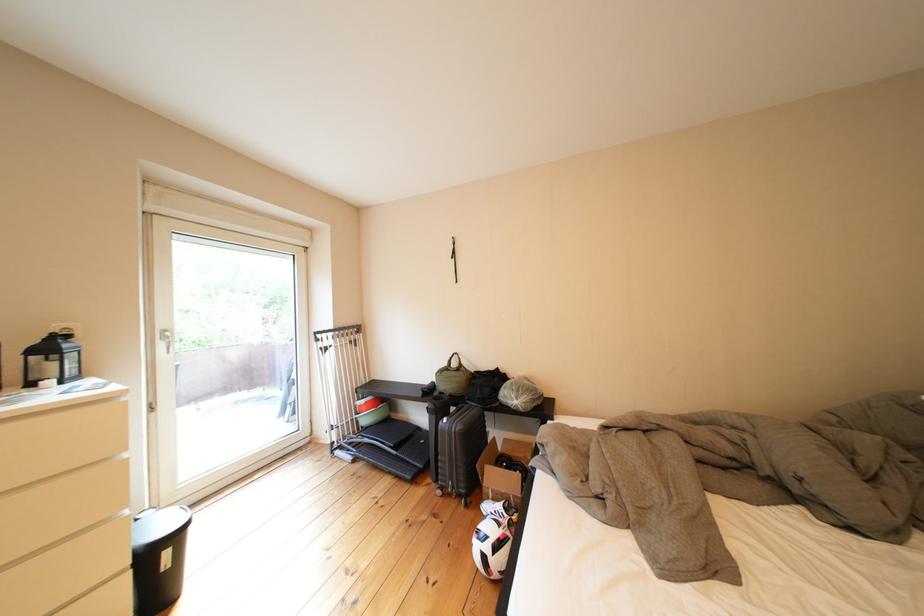
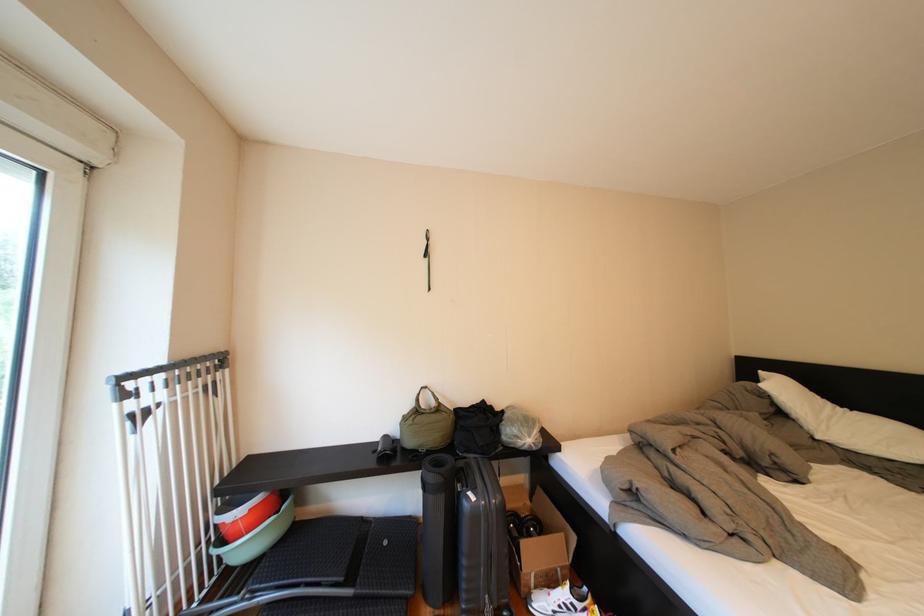
In the second image, find the point that corresponds to (x=409, y=461) in the first image.

(370, 602)